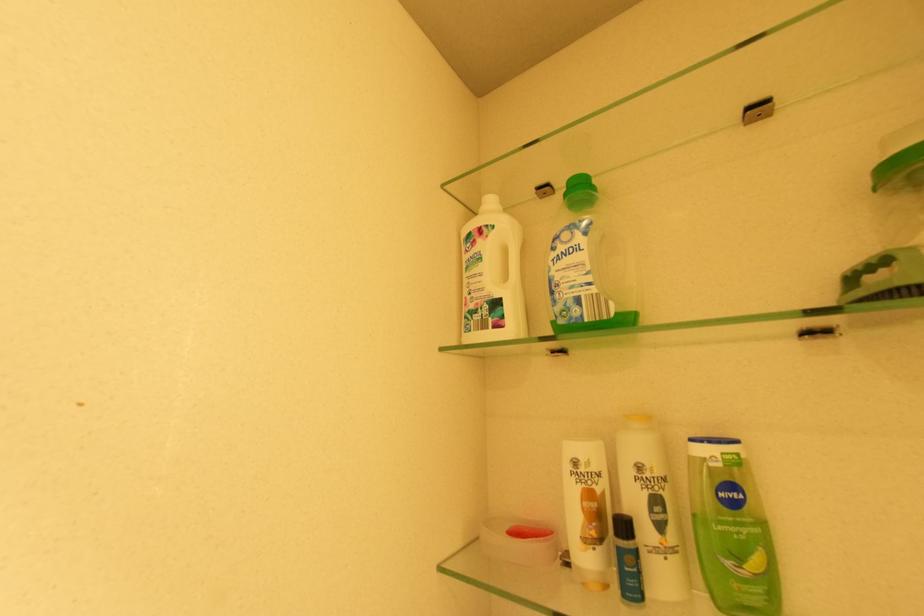
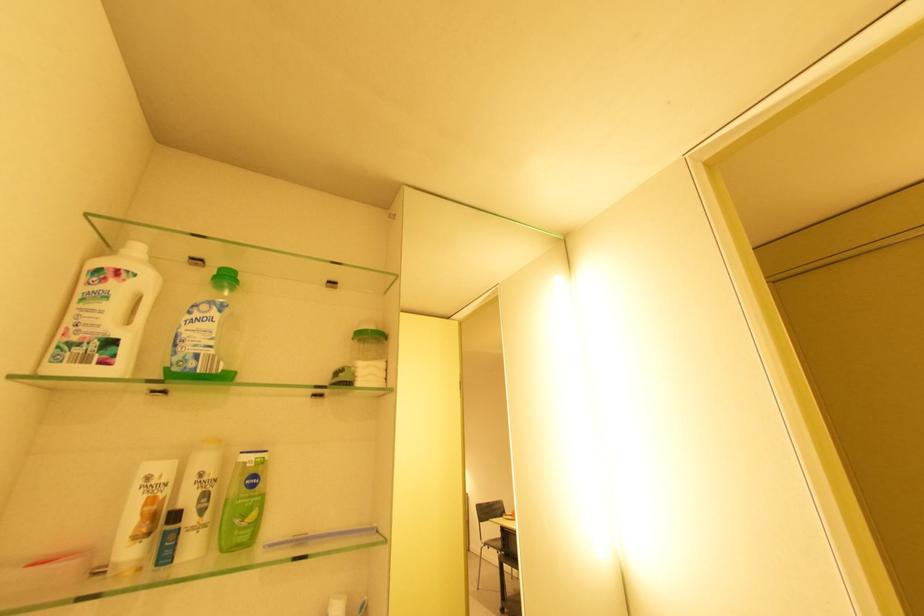
Locate, in the second image, the point that corresponds to point (511, 278) in the first image.

(134, 321)